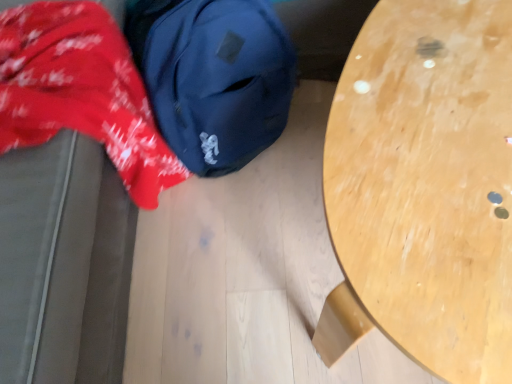
Question: Is light wood table at center bigger or smaller than red cotton fabric at left?

Choices:
 (A) small
 (B) big

Answer: (A)

Question: Would you say light wood table at center is to the left or to the right of red cotton fabric at left in the picture?

Choices:
 (A) right
 (B) left

Answer: (A)

Question: Estimate the real-world distances between objects in this image. Which object is farther from the light wood table at center?

Choices:
 (A) navy blue fabric backpack at upper left
 (B) red cotton fabric at left

Answer: (B)

Question: Based on their relative distances, which object is nearer to the red cotton fabric at left?

Choices:
 (A) light wood table at center
 (B) navy blue fabric backpack at upper left

Answer: (B)